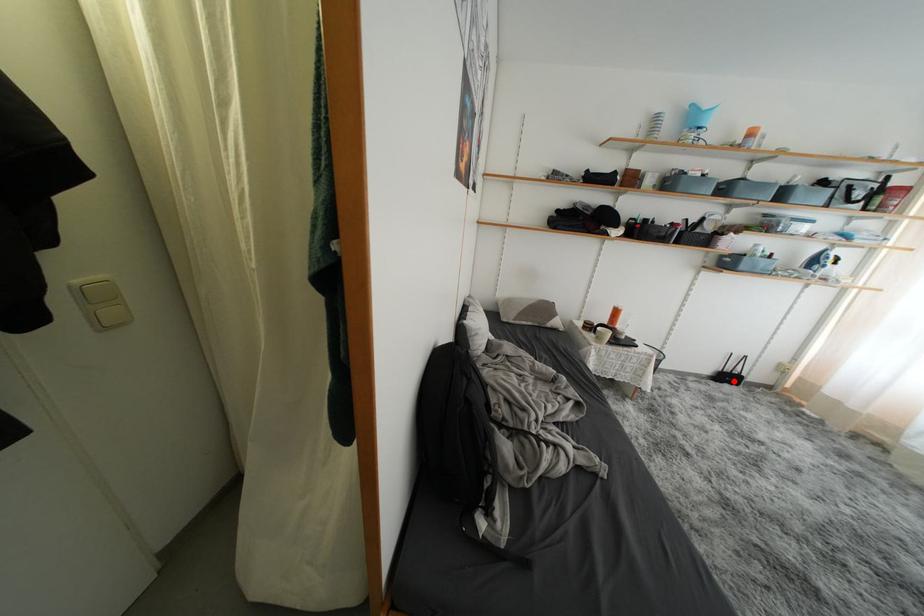
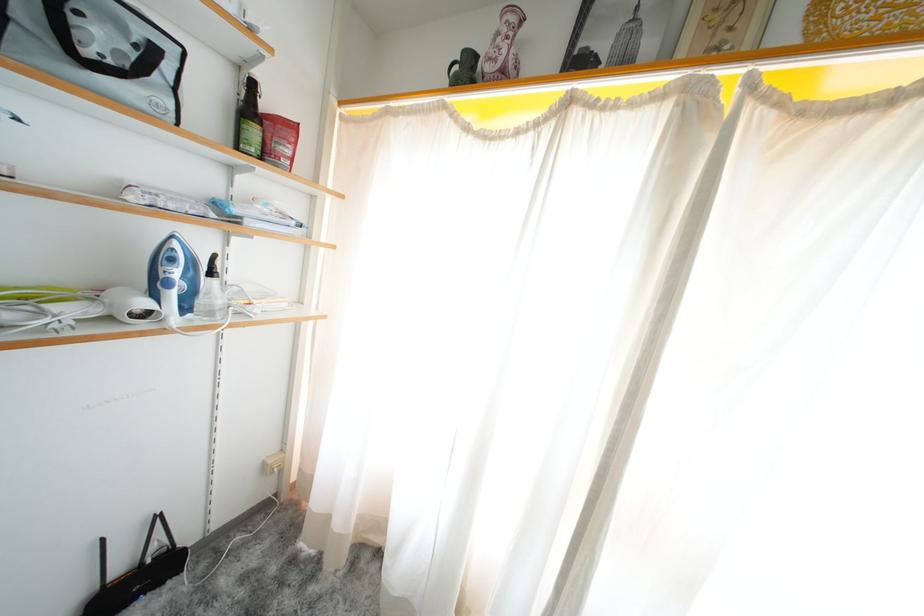
Question: I am providing you with two images of the same scene from different viewpoints. Image1 has a red point marked. In image2, the corresponding 3D location appears at what relative position? Reply with the corresponding letter.

Choices:
 (A) Closer
 (B) Farther

Answer: (A)